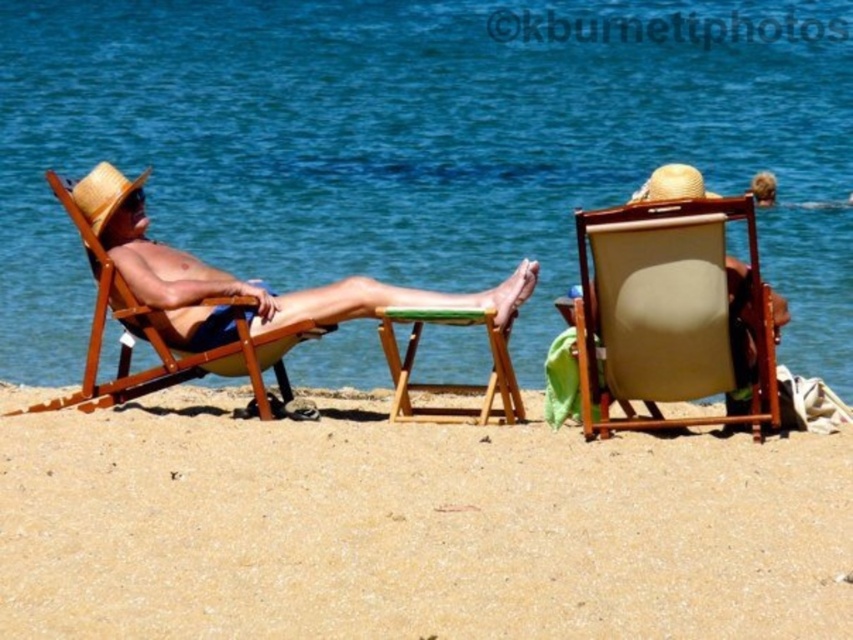
You are standing at the camera position and want to place a 1.5 meter long umbrella between the green wood stool at center and the nearest beach chair. Is there enough space?

The green wood stool at center is 7.55 meters from the camera, so there is enough space to place a 1.5 meter long umbrella between the green wood stool at center and the nearest beach chair.

You are planning to take a photo of the matte straw hat at center and the wooden beach chair at left. Which object should you focus on first if you want to capture both in the same frame without moving the camera? Explain your reasoning based on their positions.

The matte straw hat at center is shorter than the wooden beach chair at left, so you should focus on the wooden beach chair at left first since it is taller and might require adjusting the camera angle to include both in the frame.